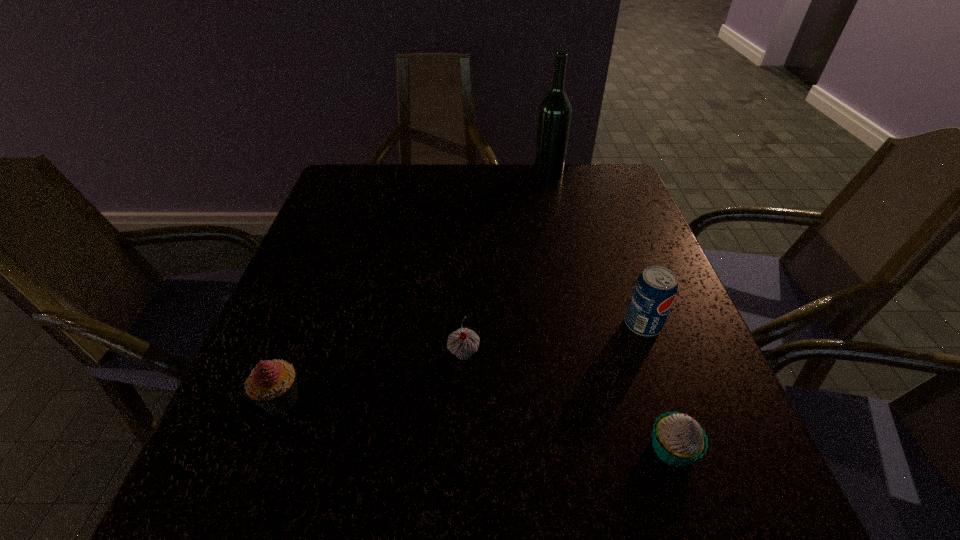
Find the location of a particular element. This screenshot has height=540, width=960. vacant area that lies between the third farthest object and the fourth shortest object is located at coordinates (553, 339).

Where is `free point between the farthest object and the nearest object`? This screenshot has width=960, height=540. free point between the farthest object and the nearest object is located at coordinates (611, 310).

Locate an element on the screen. unoccupied area between the farthest object and the second tallest object is located at coordinates (595, 248).

Locate an element on the screen. The image size is (960, 540). vacant space that's between the second cupcake from right to left and the second nearest cupcake is located at coordinates (372, 376).

This screenshot has height=540, width=960. I want to click on vacant region between the farthest object and the third farthest object, so click(506, 262).

This screenshot has width=960, height=540. In order to click on vacant area that lies between the second nearest cupcake and the fourth nearest object in this screenshot , I will do `click(462, 362)`.

In order to click on object that stands as the closest to the alcohol in this screenshot , I will do `click(655, 290)`.

The image size is (960, 540). Find the location of `object that is the fourth closest one to the farthest cupcake`. object that is the fourth closest one to the farthest cupcake is located at coordinates (554, 117).

You are a GUI agent. You are given a task and a screenshot of the screen. Output one action in this format:
    pyautogui.click(x=<x>, y=<y>)
    Task: Click on the second closest cupcake to the nearest cupcake
    The height and width of the screenshot is (540, 960).
    Given the screenshot: What is the action you would take?
    pyautogui.click(x=272, y=385)

Find the location of a particular element. cupcake that is the closest to the tallest object is located at coordinates (463, 342).